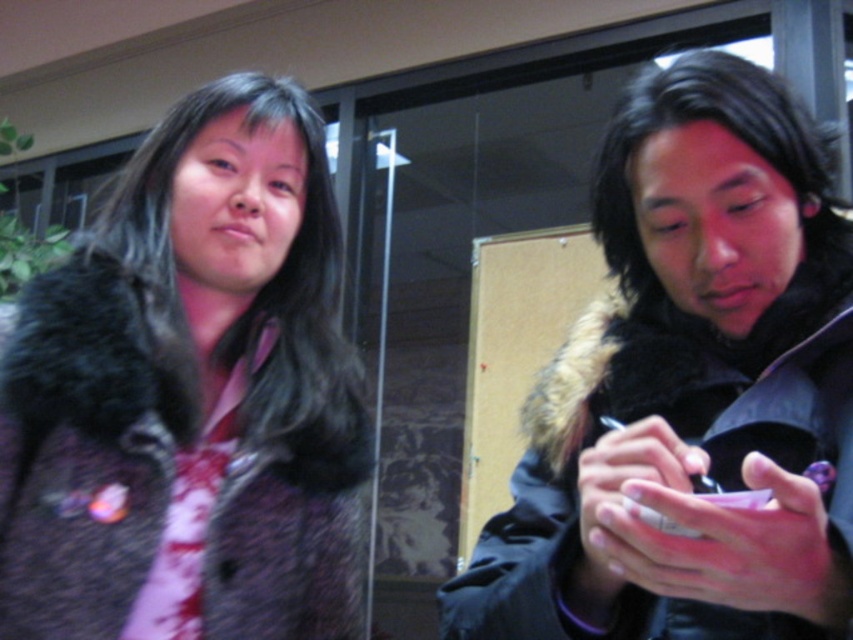
You are standing in the room and want to take a closer look at the point at coordinates point (265, 634). If you can move forward 30 inches, will you be able to reach that point?

The distance between point (265, 634) and the camera is 33.01 inches. Moving forward 30 inches would leave you 3.01 inches away from the point, so yes, you can reach it.

You are standing in the room and want to hand a package to the person wearing the fuzzy fur coat at left. Based on their position, where should you approach from to reach them?

The fuzzy fur coat at left is located at point (190, 396), so you should approach from the left side to reach the person wearing the fuzzy fur coat at left.

You are standing in a room where two people are present. You notice the fuzzy fur coat at left and the black fur coat at right. Which of these two coats is closer to you?

The fuzzy fur coat at left is closer to you because the black fur coat at right is positioned behind it.